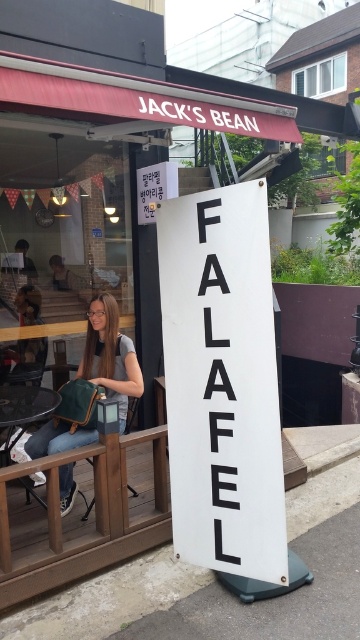
You are a customer standing in front of Jacks Bean and want to take a photo of the white matte sign at center and the matte green bag at left. Which object should you zoom in more on to capture both in the frame without cropping?

Since the white matte sign at center is smaller than the matte green bag at left, you should zoom in more on the white matte sign at center to ensure both fit in the frame without cropping.

You are a delivery person who needs to place a matte green bag at left next to the white matte sign at center. Considering their sizes, will the bag fit next to the sign without overlapping?

The white matte sign at center is much taller than the matte green bag at left, so the bag will fit next to the sign without overlapping since it is shorter in height.